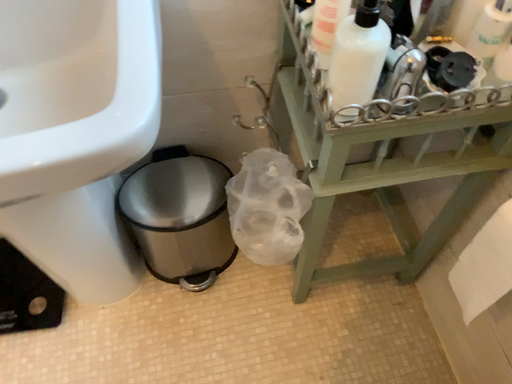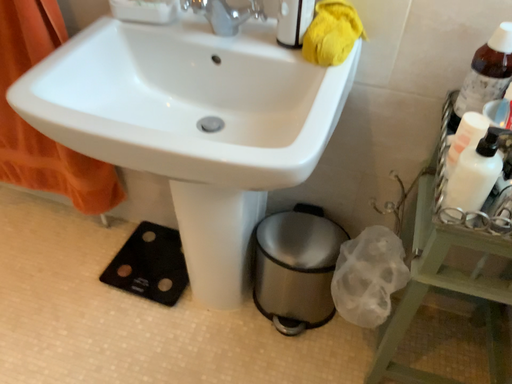
Question: Which way did the camera rotate in the video?

Choices:
 (A) rotated right
 (B) rotated left

Answer: (B)